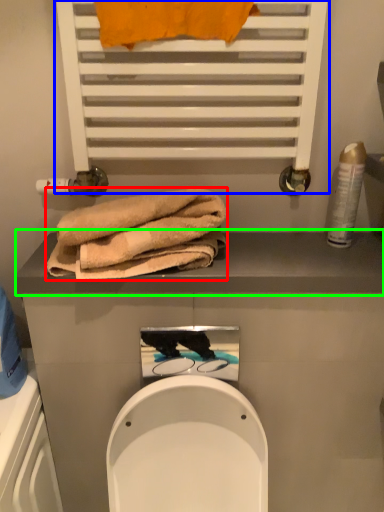
Question: Which object is positioned farthest from towel (highlighted by a red box)? Select from shelf (highlighted by a blue box) and balustrade (highlighted by a green box).

Choices:
 (A) shelf
 (B) balustrade

Answer: (A)